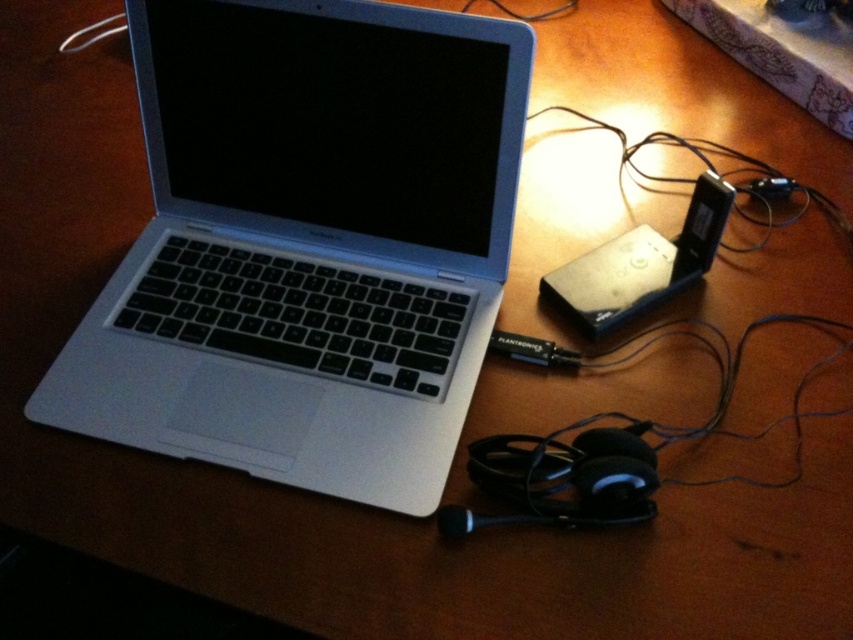
From the picture: Please describe the object located at the coordinates point (306, 243) in the image.

The point (306, 243) indicates the silver metallic laptop at center.